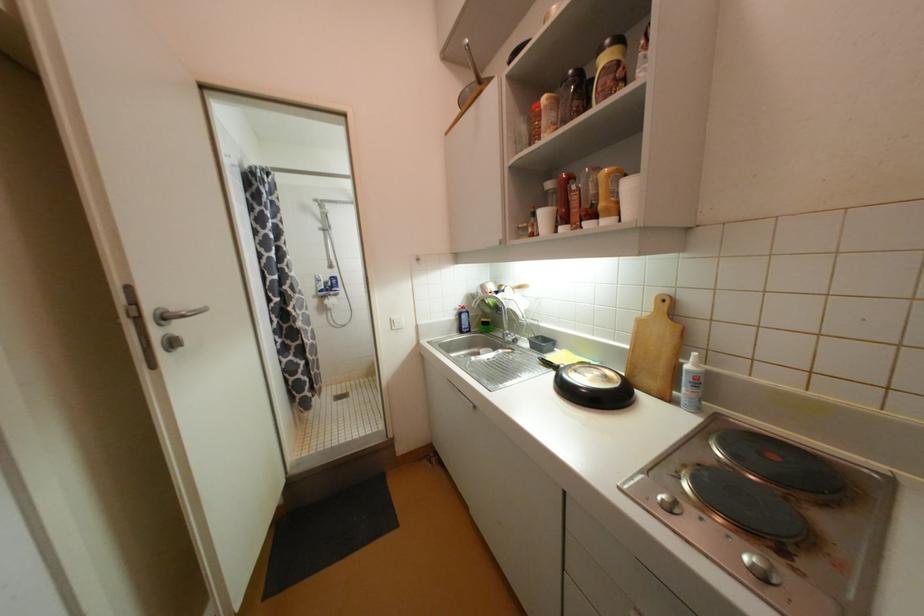
Image resolution: width=924 pixels, height=616 pixels. What do you see at coordinates (549, 363) in the screenshot?
I see `a black pan handle` at bounding box center [549, 363].